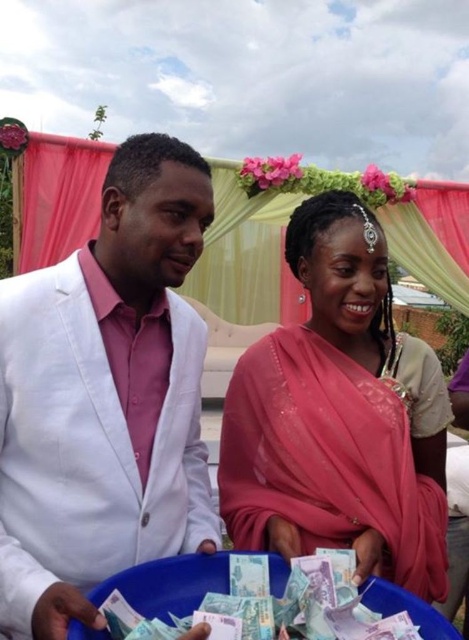
You are at a celebratory event and see the white matte suit at left and the light blue paper money at lower center. Which object is located to the left of the other?

The white matte suit at left is positioned on the left side of light blue paper money at lower center.

You are a photographer at the event and need to ensure both the white matte suit at left and the light blue paper money at lower center are clearly visible in your photo. Given their sizes, which object should you focus on first to ensure proper focus?

The white matte suit at left is larger in size than the light blue paper money at lower center, so you should focus on the white matte suit at left first to ensure proper focus.

You are a photographer positioned at the camera. You want to capture a closeup of the pink silk saree at center without moving the camera. Is it possible to do so with your current setup?

The pink silk saree at center is 4.08 feet away from camera, so if your camera lens has a sufficient zoom capability, you can capture a closeup of the pink silk saree at center from this distance without moving the camera.